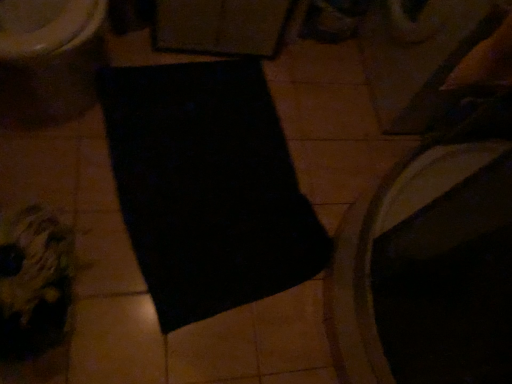
Image resolution: width=512 pixels, height=384 pixels. Identify the location of vacant space underneath black matte yoga mat at center (from a real-world perspective). (206, 176).